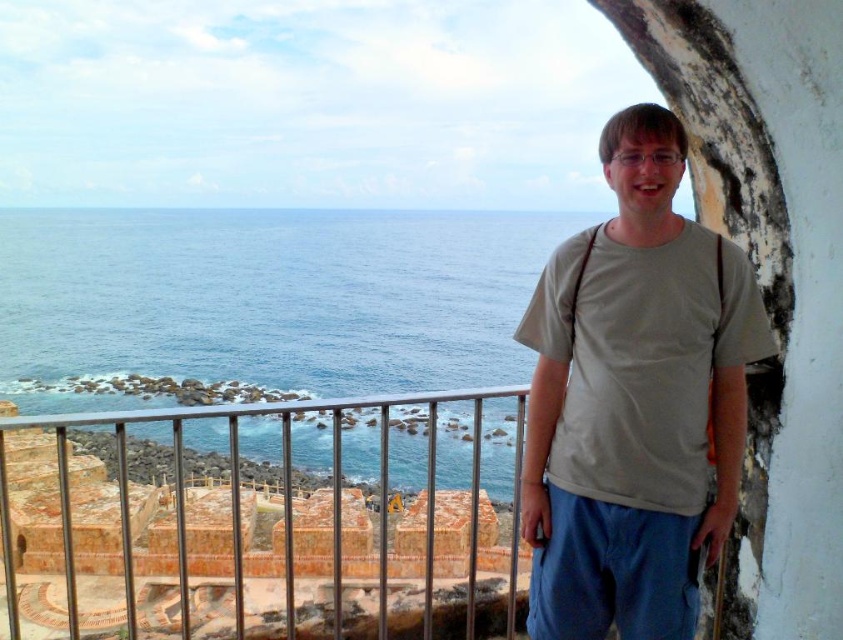
Is metal/rustic rail at lower left wider than gray cotton t-shirt at right?

Yes.

Consider the image. Measure the distance between point (110, 604) and camera.

Point (110, 604) is 41.41 meters away from camera.

Identify the location of metal/rustic rail at lower left. The width and height of the screenshot is (843, 640). (248, 536).